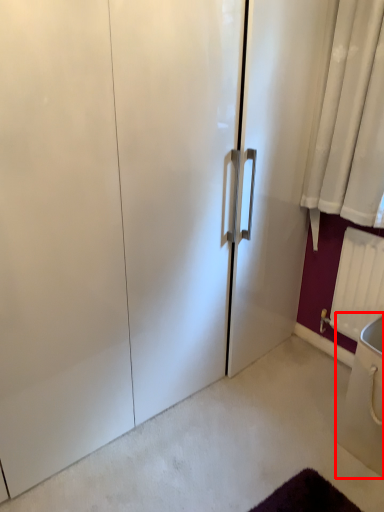
Question: From the image's perspective, where is sink (annotated by the red box) located relative to radiator?

Choices:
 (A) above
 (B) below

Answer: (B)